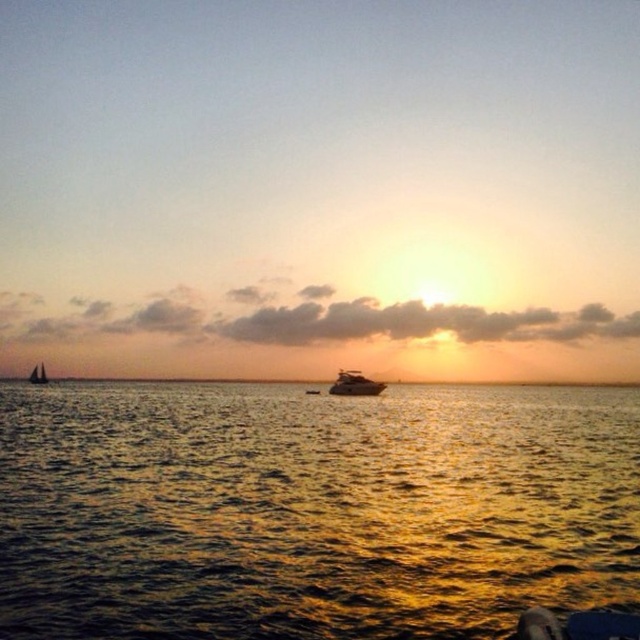
You are standing on the shore observing the sunset. You notice both the shiny golden water at center and the shiny silver yacht at center. Which object is nearer to you?

The shiny golden water at center is closer to the viewer than the shiny silver yacht at center.

You are an observer standing on the shore looking at the shiny silver yacht at center and the white sailboat at left. Which boat has a smaller width?

The shiny silver yacht at center has a smaller width than the white sailboat at left.

You are an artist trying to paint the sunset scene. You notice the shiny golden water at center and the shiny silver yacht at center. Which object should you paint first if you want to follow the rule of painting larger objects before smaller ones?

You should paint the shiny golden water at center first because it is bigger than the shiny silver yacht at center.